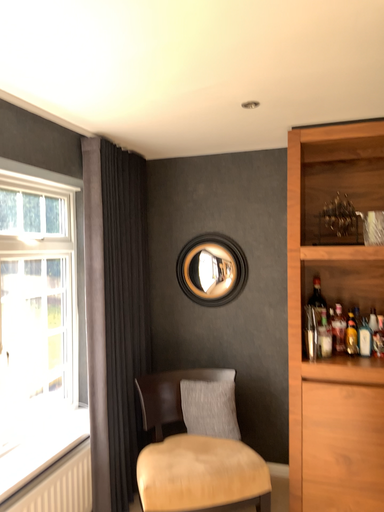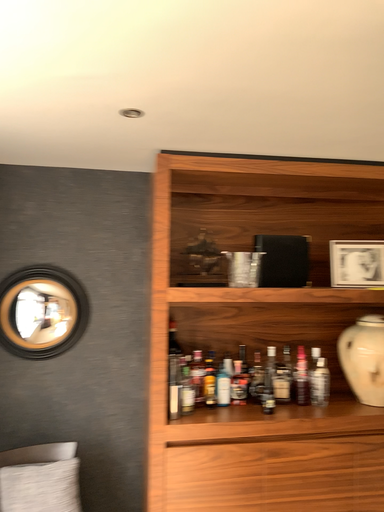
Question: Which way did the camera rotate in the video?

Choices:
 (A) rotated left
 (B) rotated right

Answer: (B)